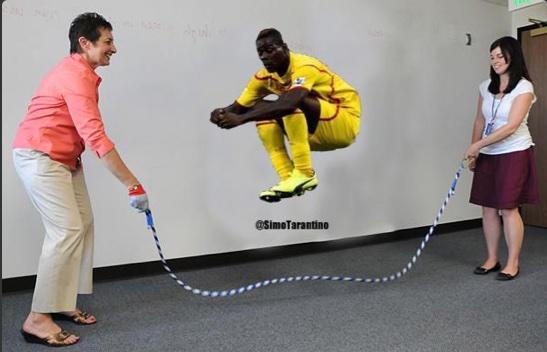
I want to click on door, so click(531, 50).